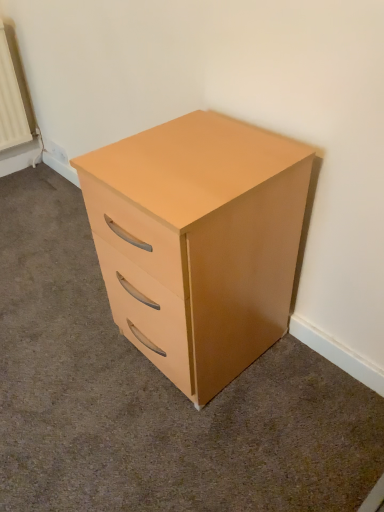
The image size is (384, 512). What do you see at coordinates (198, 242) in the screenshot? I see `matte wood chest of drawers at center` at bounding box center [198, 242].

Identify the location of matte wood chest of drawers at center. The image size is (384, 512). (198, 242).

The height and width of the screenshot is (512, 384). What are the coordinates of `matte wood chest of drawers at center` in the screenshot? It's located at (198, 242).